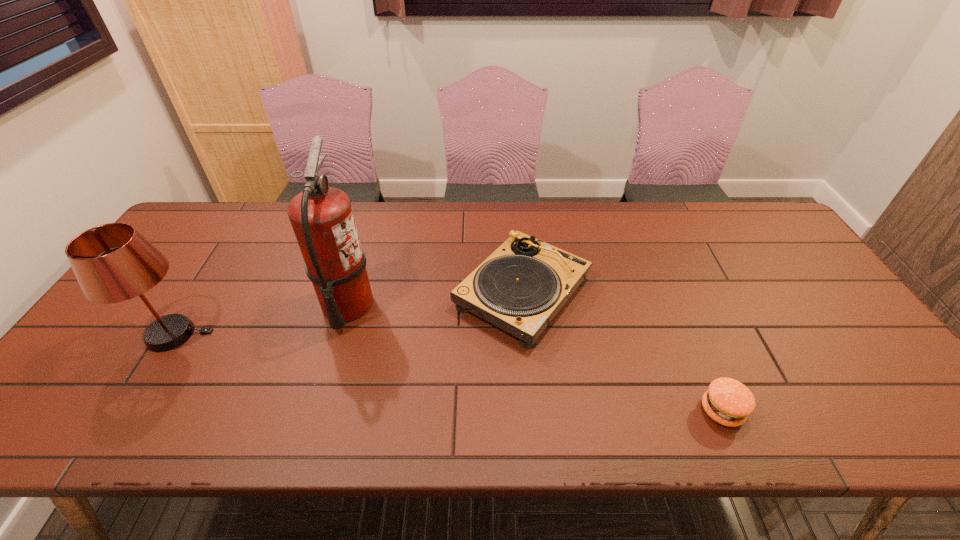
At what (x,y) coordinates should I click in order to perform the action: click on free space between the leftmost object and the patty. Please return your answer as a coordinate pair (x, y). The image size is (960, 540). Looking at the image, I should click on (x=448, y=373).

This screenshot has width=960, height=540. Find the location of `empty space between the lampshade and the shortest object`. empty space between the lampshade and the shortest object is located at coordinates (448, 373).

What are the coordinates of `vacant area between the tallest object and the leftmost object` in the screenshot? It's located at (261, 320).

Where is `free point between the nearest object and the tallest object`? Image resolution: width=960 pixels, height=540 pixels. free point between the nearest object and the tallest object is located at coordinates (535, 358).

Locate an element on the screen. vacant region between the tallest object and the lampshade is located at coordinates (261, 320).

You are a GUI agent. You are given a task and a screenshot of the screen. Output one action in this format:
    pyautogui.click(x=<x>, y=<y>)
    Task: Click on the vacant area between the third shortest object and the fire extinguisher
    Image resolution: width=960 pixels, height=540 pixels.
    Given the screenshot: What is the action you would take?
    pyautogui.click(x=261, y=320)

What are the coordinates of `vacant region between the fire extinguisher and the second object from right to left` in the screenshot? It's located at (435, 299).

You are a GUI agent. You are given a task and a screenshot of the screen. Output one action in this format:
    pyautogui.click(x=<x>, y=<y>)
    Task: Click on the closest object to the patty
    This screenshot has width=960, height=540.
    Given the screenshot: What is the action you would take?
    pyautogui.click(x=522, y=285)

The width and height of the screenshot is (960, 540). Identify the location of object that ranks as the second closest to the leftmost object. (522, 285).

This screenshot has width=960, height=540. Find the location of `vacant space that satisfies the following two spatial constraints: 1. on the front side of the record player; 2. on the front-facing side of the third shortest object`. vacant space that satisfies the following two spatial constraints: 1. on the front side of the record player; 2. on the front-facing side of the third shortest object is located at coordinates (526, 334).